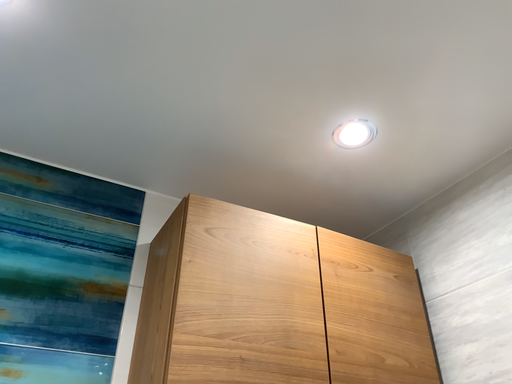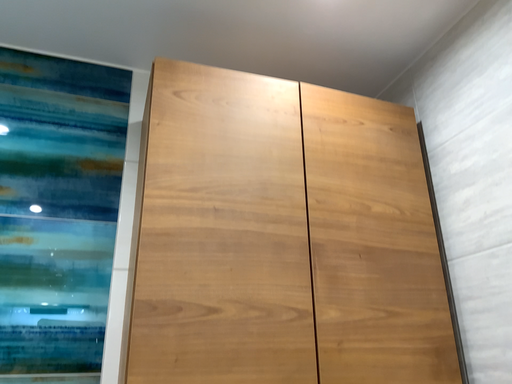
Question: How did the camera likely rotate when shooting the video?

Choices:
 (A) rotated upward
 (B) rotated downward

Answer: (B)